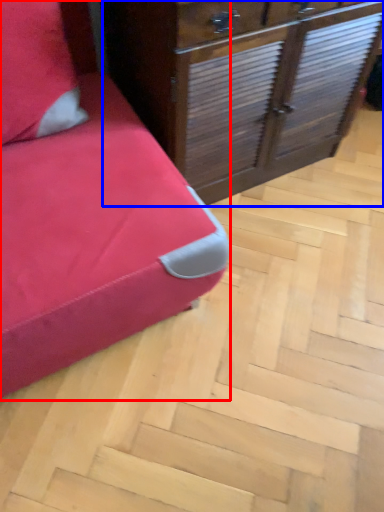
Question: Which object is closer to the camera taking this photo, furniture (highlighted by a red box) or chest of drawers (highlighted by a blue box)?

Choices:
 (A) furniture
 (B) chest of drawers

Answer: (A)